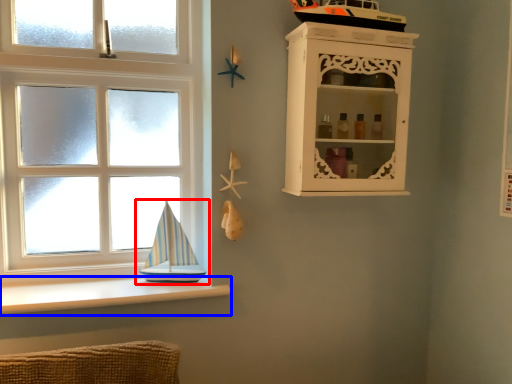
Question: Which object is further to the camera taking this photo, boat (highlighted by a red box) or ledge (highlighted by a blue box)?

Choices:
 (A) boat
 (B) ledge

Answer: (A)